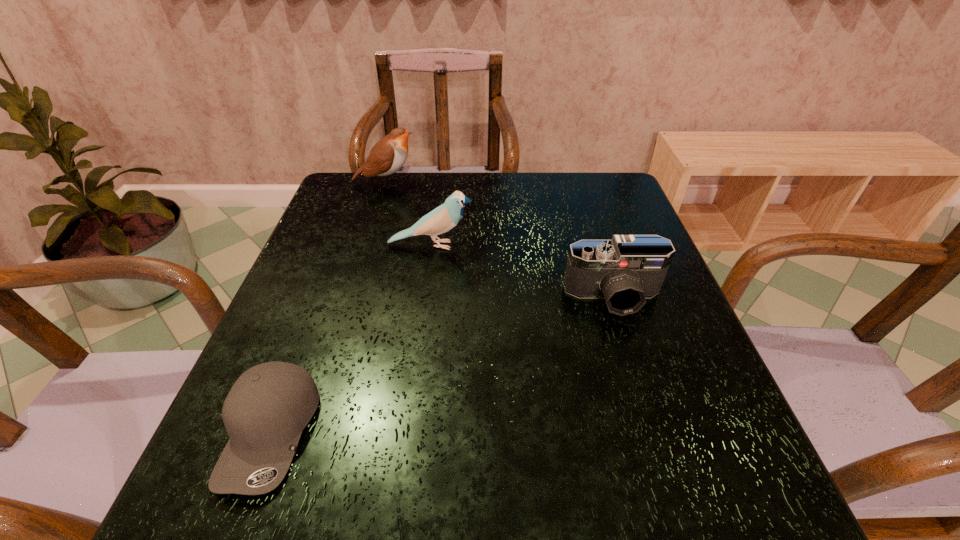
The height and width of the screenshot is (540, 960). I want to click on vacant space in between the camera and the shortest object, so click(x=443, y=364).

Identify the location of vacant space that's between the third farthest object and the nearer bird. The width and height of the screenshot is (960, 540). (523, 271).

Identify which object is located as the second nearest to the nearer bird. Please provide its 2D coordinates. Your answer should be formatted as a tuple, i.e. [(x, y)], where the tuple contains the x and y coordinates of a point satisfying the conditions above.

[(387, 156)]

Image resolution: width=960 pixels, height=540 pixels. I want to click on object that stands as the closest to the baseball cap, so click(443, 218).

Identify the location of vacant region that satisfies the following two spatial constraints: 1. at the face of the farthest object; 2. on the front brim of the nearest object. (308, 432).

Where is `free space in the image that satisfies the following two spatial constraints: 1. at the face of the third nearest object; 2. on the front brim of the nearest object`? free space in the image that satisfies the following two spatial constraints: 1. at the face of the third nearest object; 2. on the front brim of the nearest object is located at coordinates (408, 432).